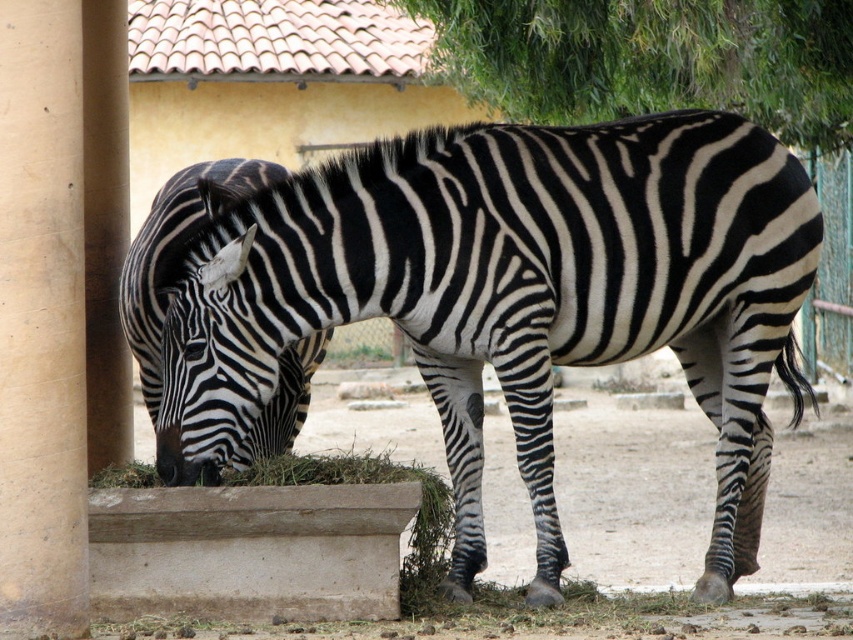
Question: Does black and white striped zebra at center have a larger size compared to black and white striped zebra at lower left?

Choices:
 (A) no
 (B) yes

Answer: (B)

Question: Which of the following is the farthest from the observer?

Choices:
 (A) (340, 291)
 (B) (164, 285)

Answer: (A)

Question: Which object is the closest to the green leafy tree at upper center?

Choices:
 (A) black and white striped zebra at center
 (B) black and white striped zebra at lower left

Answer: (A)

Question: Does green leafy tree at upper center lie in front of black and white striped zebra at lower left?

Choices:
 (A) no
 (B) yes

Answer: (A)

Question: Which object appears farthest from the camera in this image?

Choices:
 (A) green leafy tree at upper center
 (B) black and white striped zebra at lower left

Answer: (A)

Question: Is black and white striped zebra at center above green leafy tree at upper center?

Choices:
 (A) yes
 (B) no

Answer: (B)